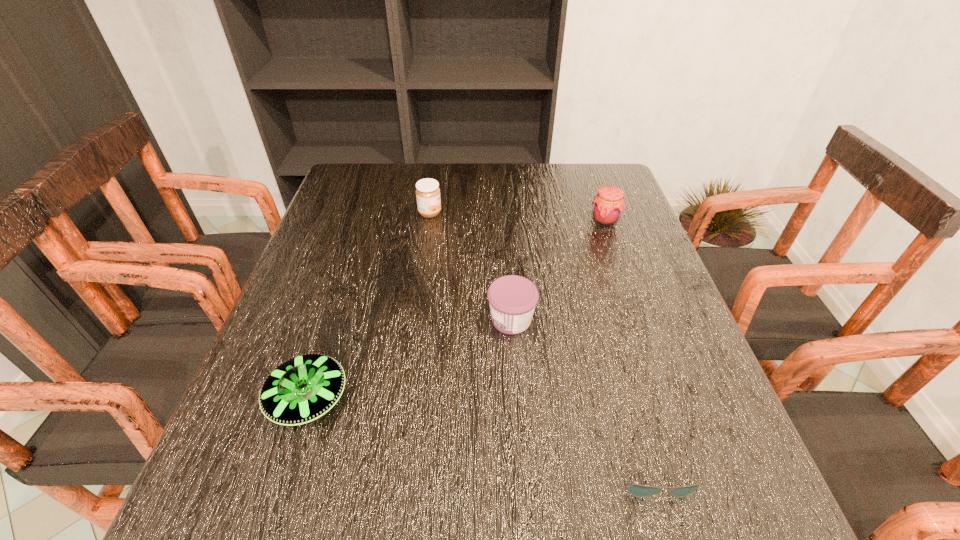
The image size is (960, 540). In order to click on the second object from left to right in this screenshot , I will do `click(427, 191)`.

Locate an element on the screen. the rightmost jam is located at coordinates (608, 204).

What are the coordinates of `the second jam from right to left` in the screenshot? It's located at (512, 299).

You are a GUI agent. You are given a task and a screenshot of the screen. Output one action in this format:
    pyautogui.click(x=<x>, y=<y>)
    Task: Click on the third farthest object
    
    Given the screenshot: What is the action you would take?
    pyautogui.click(x=512, y=299)

You are a GUI agent. You are given a task and a screenshot of the screen. Output one action in this format:
    pyautogui.click(x=<x>, y=<y>)
    Task: Click on the saucer
    Image resolution: width=960 pixels, height=540 pixels.
    Given the screenshot: What is the action you would take?
    pyautogui.click(x=302, y=389)

Where is `the second shortest object`? The height and width of the screenshot is (540, 960). the second shortest object is located at coordinates (302, 389).

Where is `the shortest object`? The height and width of the screenshot is (540, 960). the shortest object is located at coordinates (640, 491).

Locate an element on the screen. The width and height of the screenshot is (960, 540). blank area located on the front label of the second object from left to right is located at coordinates (489, 213).

Locate an element on the screen. This screenshot has height=540, width=960. vacant space located on the front of the rightmost jam is located at coordinates (647, 341).

Locate an element on the screen. This screenshot has width=960, height=540. free space located 0.130m on the front label of the third object from right to left is located at coordinates (425, 320).